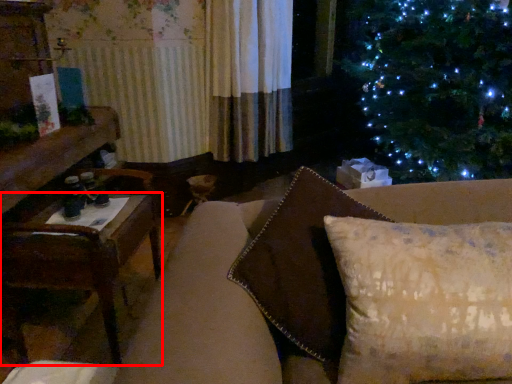
Question: In this image, where is table (annotated by the red box) located relative to pillow?

Choices:
 (A) left
 (B) right

Answer: (A)